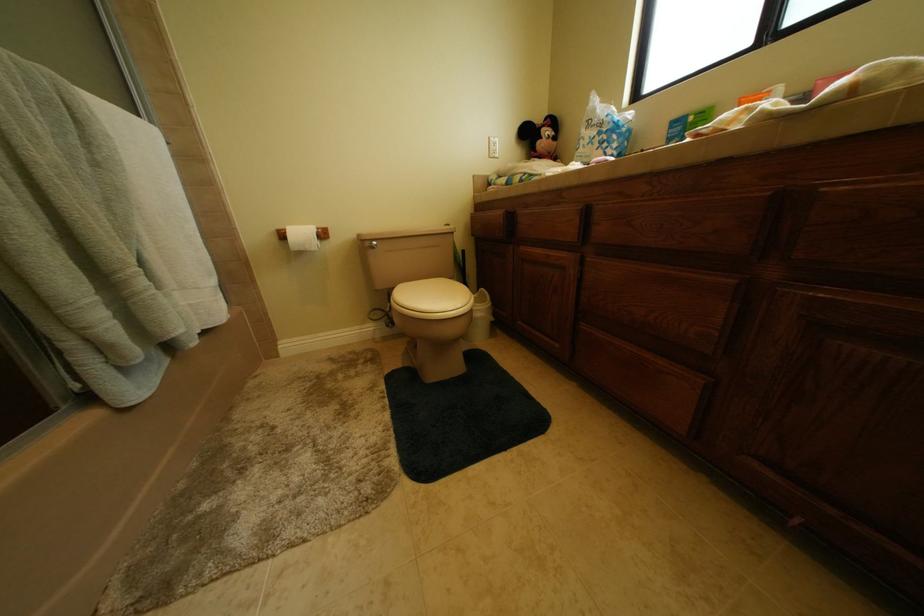
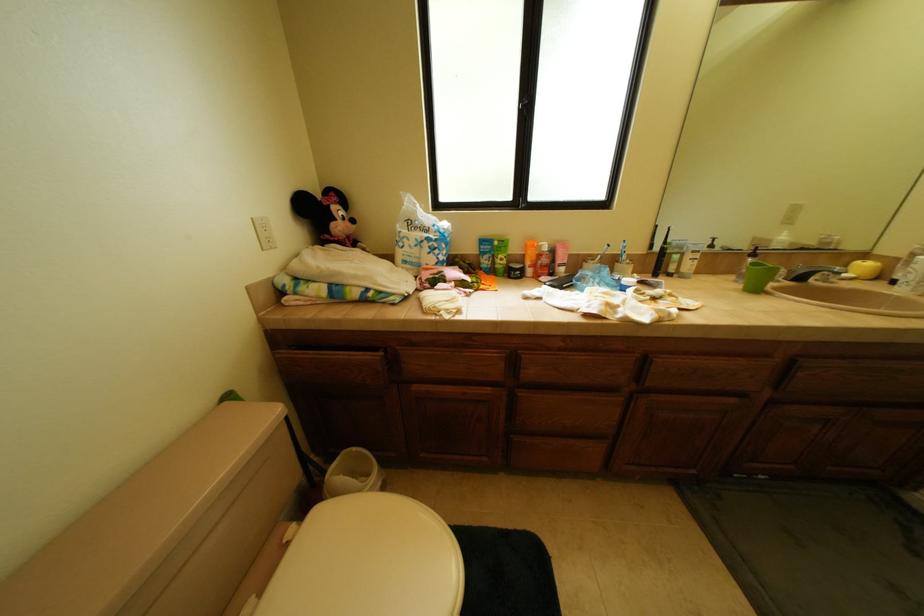
Question: Based on the continuous images, in which direction is the camera rotating? Reply with the corresponding letter.

Choices:
 (A) Left
 (B) Right
 (C) Up
 (D) Down

Answer: (B)